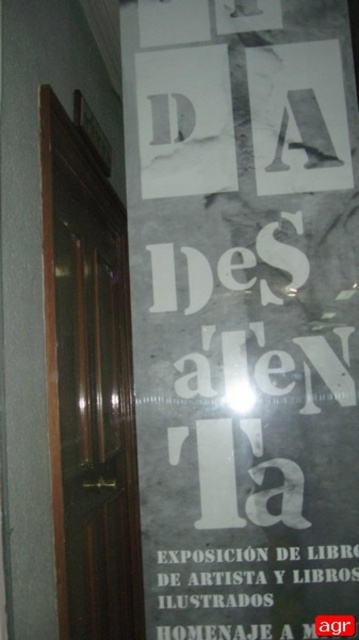
Which is below, white paper poster at center or brown polished wood door at left?

brown polished wood door at left is below.

Which of these two, white paper poster at center or brown polished wood door at left, stands shorter?

white paper poster at center

Is point (239, 54) positioned after point (48, 250)?

No, (239, 54) is closer to viewer.

Locate an element on the screen. The image size is (359, 640). white paper poster at center is located at coordinates (244, 314).

Does white paper poster at center have a greater width compared to white paper sign at lower center?

Correct, the width of white paper poster at center exceeds that of white paper sign at lower center.

Based on the photo, does white paper poster at center have a larger size compared to white paper sign at lower center?

Indeed, white paper poster at center has a larger size compared to white paper sign at lower center.

The height and width of the screenshot is (640, 359). I want to click on white paper poster at center, so click(x=244, y=314).

Does brown polished wood door at left come in front of white paper sign at lower center?

That is False.

Is point (132, 481) positioned behind point (294, 611)?

Yes, point (132, 481) is farther from viewer.

Identify the location of brown polished wood door at left. (89, 387).